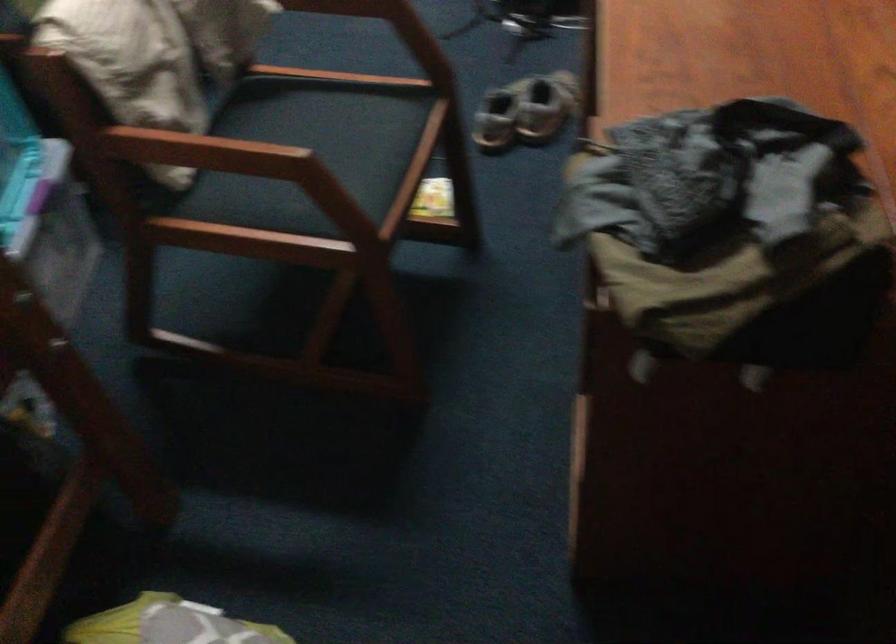
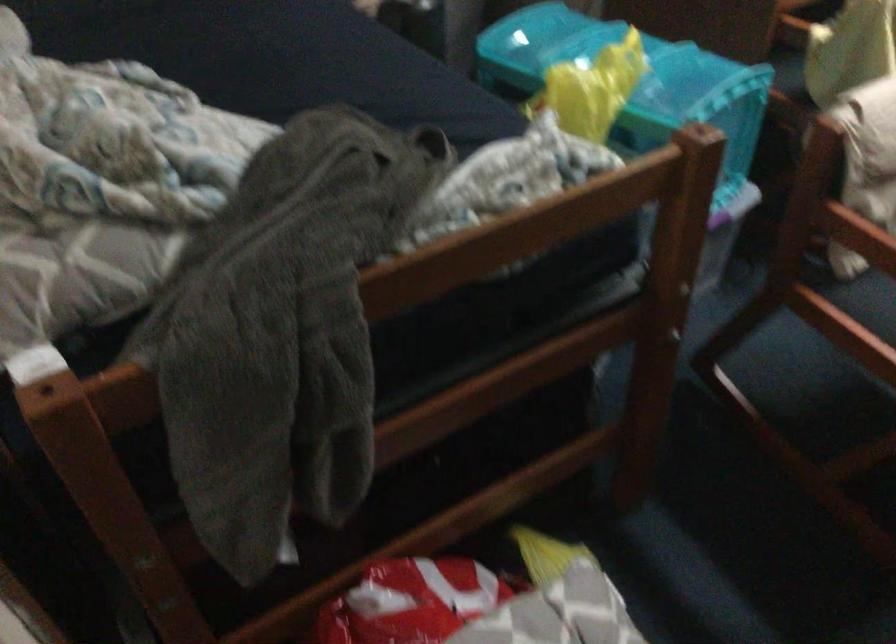
Question: The first image is from the beginning of the video and the second image is from the end. How did the camera likely rotate when shooting the video?

Choices:
 (A) Left
 (B) Right
 (C) Up
 (D) Down

Answer: (A)